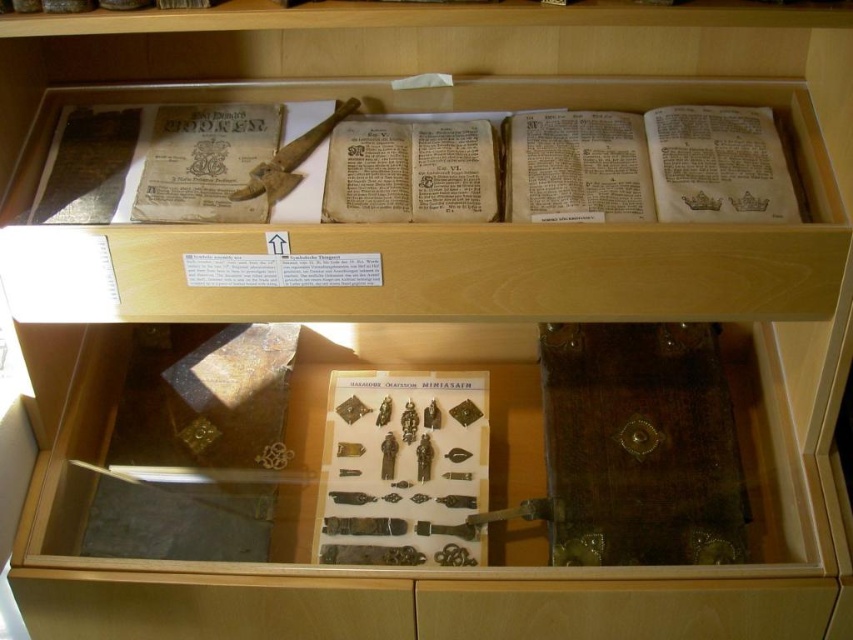
Between yellowed paper book at upper left and wooden staff at center, which one appears on the right side from the viewer's perspective?

wooden staff at center

The image size is (853, 640). In order to click on yellowed paper book at upper left in this screenshot , I will do `click(206, 163)`.

The image size is (853, 640). In order to click on yellowed paper book at upper left in this screenshot , I will do `click(206, 163)`.